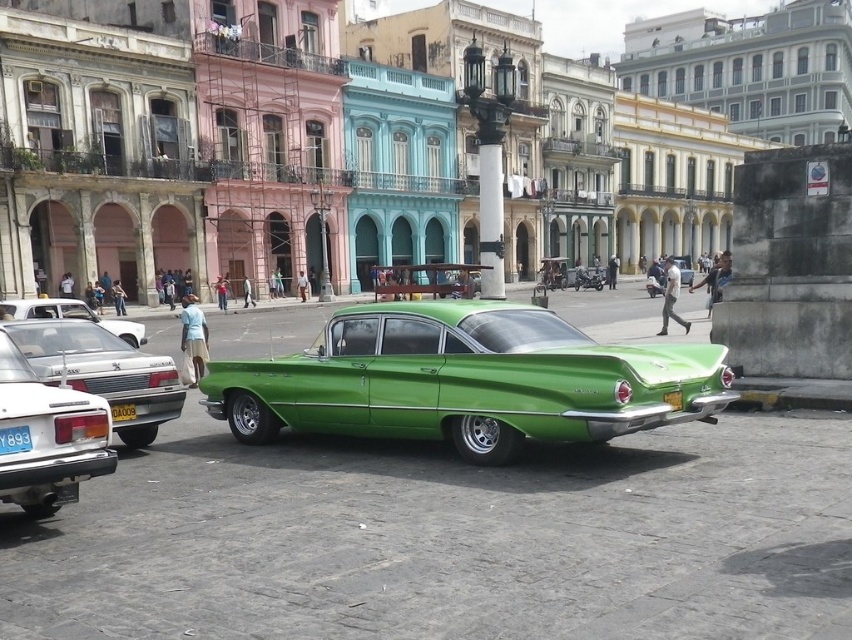
You are a tourist in this historic area and want to take a photo of both the blue plastic license plate at lower left and the yellow matte license plate at center. Which license plate should you get closer to in order to capture a clear, detailed image of it in your photo?

The blue plastic license plate at lower left is smaller than the yellow matte license plate at center, so you should get closer to the blue plastic license plate at lower left to capture its details clearly.

In the scene shown: You are a photographer standing in front of the bright green vintage car. You want to take a photo that includes both the car and a specific point in the background. The points you need to include are point (9, 435) and point (133, 412). Since you want the car to be in focus, which point should you focus on to ensure both are sharp?

You should focus on point (133, 412) because it is farther away from the camera than point (9, 435). By focusing on the farther point, the depth of field will include both the car and the closer point.